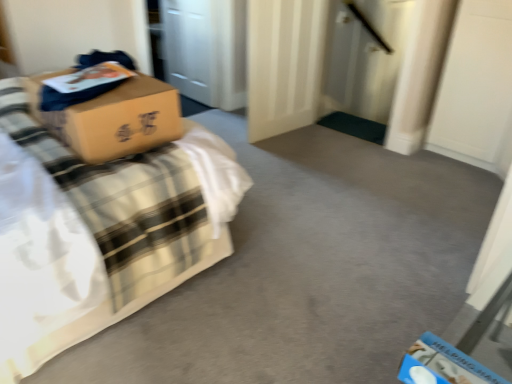
Locate an element on the screen. The image size is (512, 384). vacant space to the right of white matte door at center is located at coordinates [331, 137].